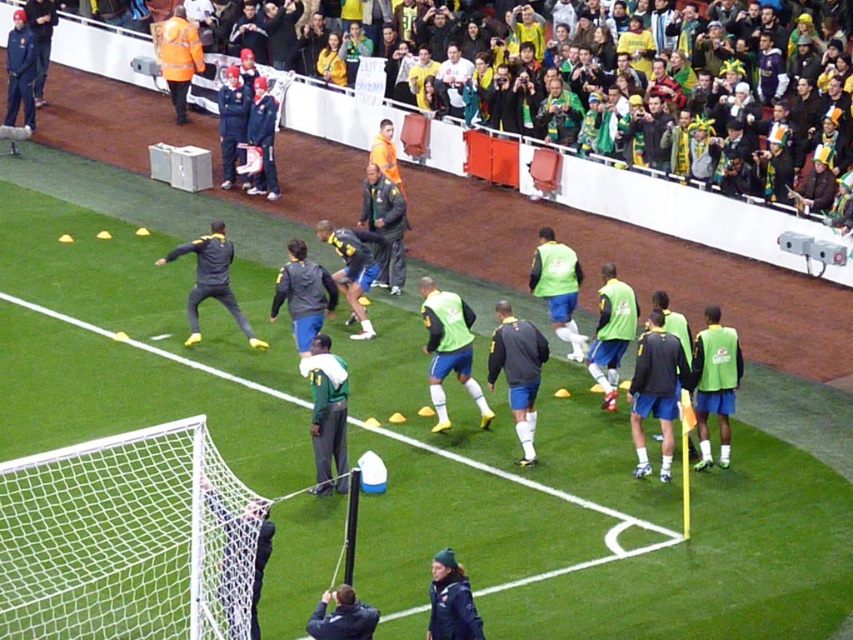
How far apart are dark green jersey at center and dark blue jacket at upper left?

dark green jersey at center is 32.55 feet from dark blue jacket at upper left.

Image resolution: width=853 pixels, height=640 pixels. What do you see at coordinates (384, 227) in the screenshot?
I see `dark green jersey at center` at bounding box center [384, 227].

Find the location of a particular element. The width and height of the screenshot is (853, 640). dark green jersey at center is located at coordinates (384, 227).

Does dark gray jacket at center appear over dark blue jacket at upper left?

Incorrect, dark gray jacket at center is not positioned above dark blue jacket at upper left.

Can you confirm if dark gray jacket at center is positioned to the right of dark blue jacket at upper left?

Indeed, dark gray jacket at center is positioned on the right side of dark blue jacket at upper left.

Which is behind, point (531, 394) or point (10, 92)?

Point (10, 92)

The image size is (853, 640). Find the location of `dark gray jacket at center`. dark gray jacket at center is located at coordinates (518, 371).

Can you confirm if white mesh net at lower left is positioned to the right of dark blue jacket at upper left?

Indeed, white mesh net at lower left is positioned on the right side of dark blue jacket at upper left.

Is point (161, 460) more distant than point (19, 54)?

No.

Is point (59, 608) behind point (24, 72)?

No, (59, 608) is closer to viewer.

Identify the location of white mesh net at lower left. (126, 540).